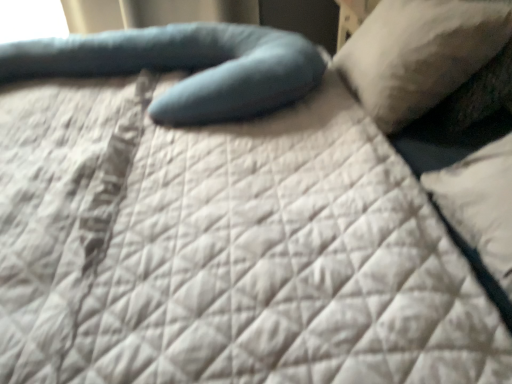
Question: Is teal fabric pillow at center, the 1th pillow viewed from the left, looking in the opposite direction of white soft pillow at upper right, acting as the first pillow starting from the right?

Choices:
 (A) yes
 (B) no

Answer: (A)

Question: From a real-world perspective, is teal fabric pillow at center, marked as the second pillow in a right-to-left arrangement, physically above white soft pillow at upper right, acting as the first pillow starting from the right?

Choices:
 (A) no
 (B) yes

Answer: (A)

Question: Is the surface of teal fabric pillow at center, the 1th pillow viewed from the left, in direct contact with white soft pillow at upper right, acting as the first pillow starting from the right?

Choices:
 (A) no
 (B) yes

Answer: (A)

Question: From the image's perspective, is teal fabric pillow at center, marked as the second pillow in a right-to-left arrangement, beneath white soft pillow at upper right, acting as the first pillow starting from the right?

Choices:
 (A) yes
 (B) no

Answer: (A)

Question: Is teal fabric pillow at center, the 1th pillow viewed from the left, taller than white soft pillow at upper right, acting as the first pillow starting from the right?

Choices:
 (A) no
 (B) yes

Answer: (A)

Question: Is white soft pillow at upper right, acting as the first pillow starting from the right, completely or partially inside teal fabric pillow at center, marked as the second pillow in a right-to-left arrangement?

Choices:
 (A) no
 (B) yes

Answer: (A)

Question: Is white soft pillow at upper right, which ranks as the second pillow in left-to-right order, wider than teal fabric pillow at center, the 1th pillow viewed from the left?

Choices:
 (A) no
 (B) yes

Answer: (A)

Question: Considering the relative sizes of white soft pillow at upper right, which ranks as the second pillow in left-to-right order, and teal fabric pillow at center, marked as the second pillow in a right-to-left arrangement, in the image provided, is white soft pillow at upper right, which ranks as the second pillow in left-to-right order, smaller than teal fabric pillow at center, marked as the second pillow in a right-to-left arrangement,?

Choices:
 (A) no
 (B) yes

Answer: (B)

Question: Does white soft pillow at upper right, acting as the first pillow starting from the right, lie in front of teal fabric pillow at center, the 1th pillow viewed from the left?

Choices:
 (A) no
 (B) yes

Answer: (B)

Question: Is white soft pillow at upper right, which ranks as the second pillow in left-to-right order, further to camera compared to teal fabric pillow at center, marked as the second pillow in a right-to-left arrangement?

Choices:
 (A) no
 (B) yes

Answer: (A)

Question: Is white soft pillow at upper right, acting as the first pillow starting from the right, positioned far away from teal fabric pillow at center, the 1th pillow viewed from the left?

Choices:
 (A) no
 (B) yes

Answer: (A)

Question: Considering the relative sizes of white soft pillow at upper right, acting as the first pillow starting from the right, and teal fabric pillow at center, marked as the second pillow in a right-to-left arrangement, in the image provided, is white soft pillow at upper right, acting as the first pillow starting from the right, shorter than teal fabric pillow at center, marked as the second pillow in a right-to-left arrangement,?

Choices:
 (A) yes
 (B) no

Answer: (B)

Question: Looking at their shapes, would you say white soft pillow at upper right, acting as the first pillow starting from the right, is wider or thinner than teal fabric pillow at center, marked as the second pillow in a right-to-left arrangement?

Choices:
 (A) wide
 (B) thin

Answer: (B)